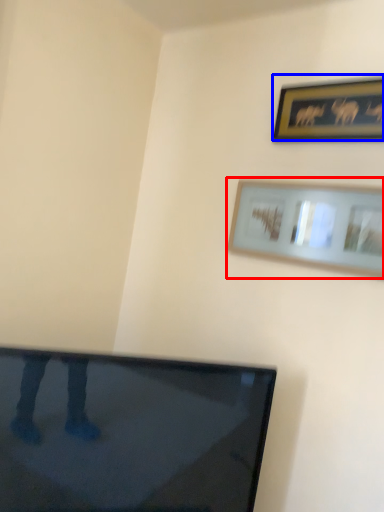
Question: Among these objects, which one is nearest to the camera, picture frame (highlighted by a red box) or picture frame (highlighted by a blue box)?

Choices:
 (A) picture frame
 (B) picture frame

Answer: (A)